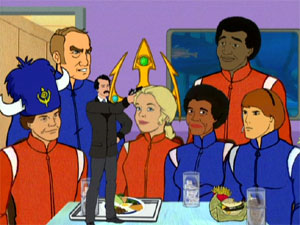
Find the location of `blue table`. blue table is located at coordinates (184, 214).